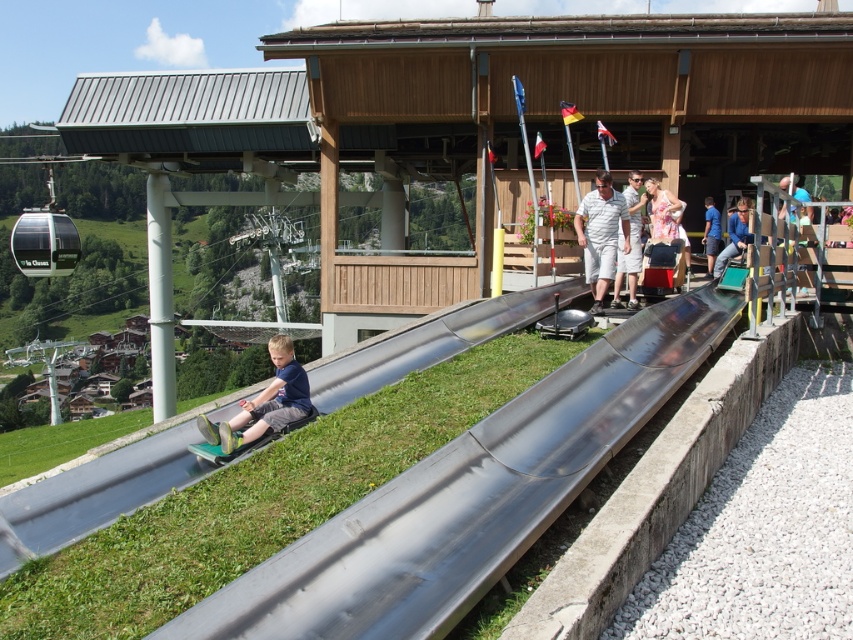
From the picture: Where is the white striped shirt at center located in the image?

The white striped shirt at center is located at the coordinates point (601,234).

You are observing a group of people at a recreational area. There is a white striped shirt at center and a light blue striped polo shirt at center. Which one is shorter in height?

The white striped shirt at center is shorter than the light blue striped polo shirt at center.

You are standing at the bottom of the slides and want to greet the person wearing the white striped shirt at center and the light blue striped polo shirt at center. Which one should you approach first to greet?

You should first approach the white striped shirt at center because it is closer to you than the light blue striped polo shirt at center.